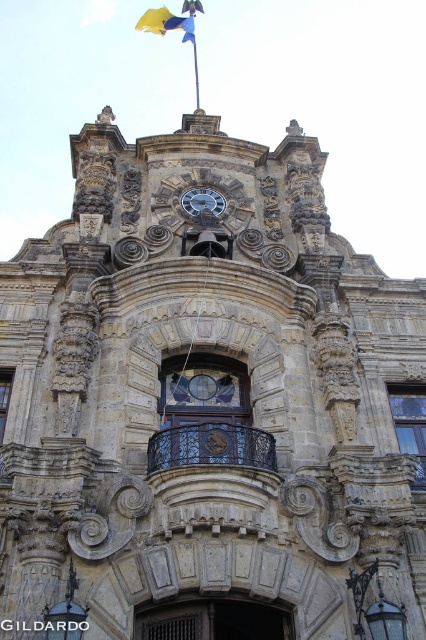
Question: Which object is positioned farthest from the silver metallic clock at center?

Choices:
 (A) yellow fabric flag at top
 (B) black wrought iron balcony at center

Answer: (A)

Question: Can you confirm if black wrought iron balcony at center is positioned above silver metallic clock at center?

Choices:
 (A) no
 (B) yes

Answer: (A)

Question: Is black wrought iron balcony at center thinner than yellow fabric flag at top?

Choices:
 (A) no
 (B) yes

Answer: (B)

Question: Which point is closer to the camera taking this photo?

Choices:
 (A) (207, 436)
 (B) (204, 204)
 (C) (150, 16)

Answer: (A)

Question: Can you confirm if black wrought iron balcony at center is positioned to the right of yellow fabric flag at top?

Choices:
 (A) no
 (B) yes

Answer: (B)

Question: Which point is closer to the camera?

Choices:
 (A) (206, 193)
 (B) (193, 36)
 (C) (198, 440)

Answer: (C)